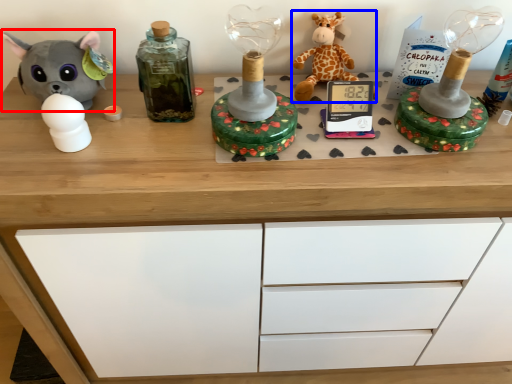
Question: Which object appears farthest to the camera in this image, toy (highlighted by a red box) or toy (highlighted by a blue box)?

Choices:
 (A) toy
 (B) toy

Answer: (B)